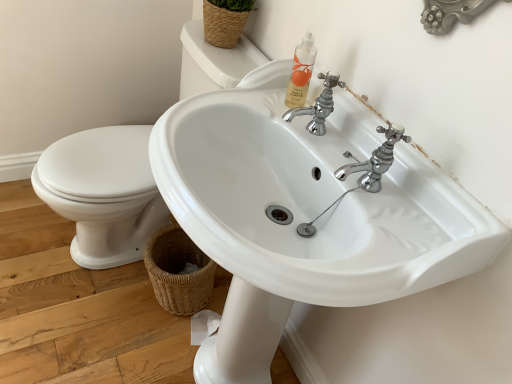
Locate an element on the screen. This screenshot has height=384, width=512. vacant space situated on the left part of brown woven basket at lower left, the 2th basket positioned from the top is located at coordinates (103, 294).